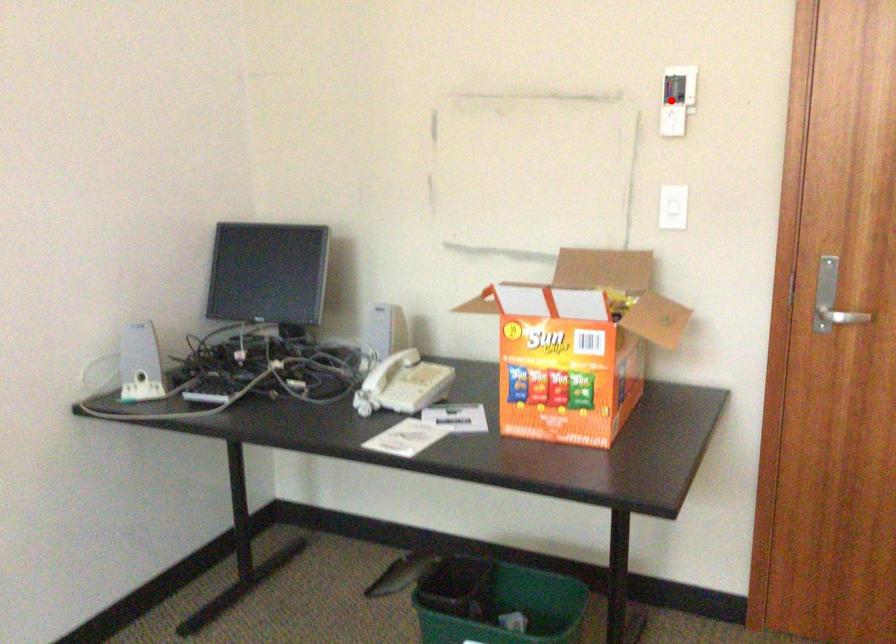
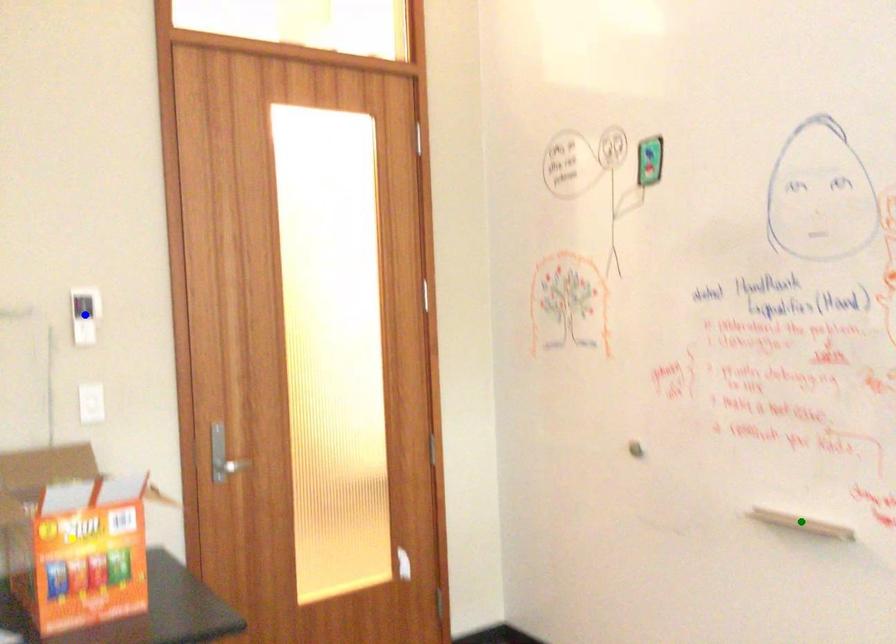
Question: I am providing you with two images of the same scene from different viewpoints. A red point is marked on the first image. You are given multiple points on the second image. Which point in image 2 represents the same 3d spot as the red point in image 1?

Choices:
 (A) green point
 (B) blue point
 (C) yellow point

Answer: (B)